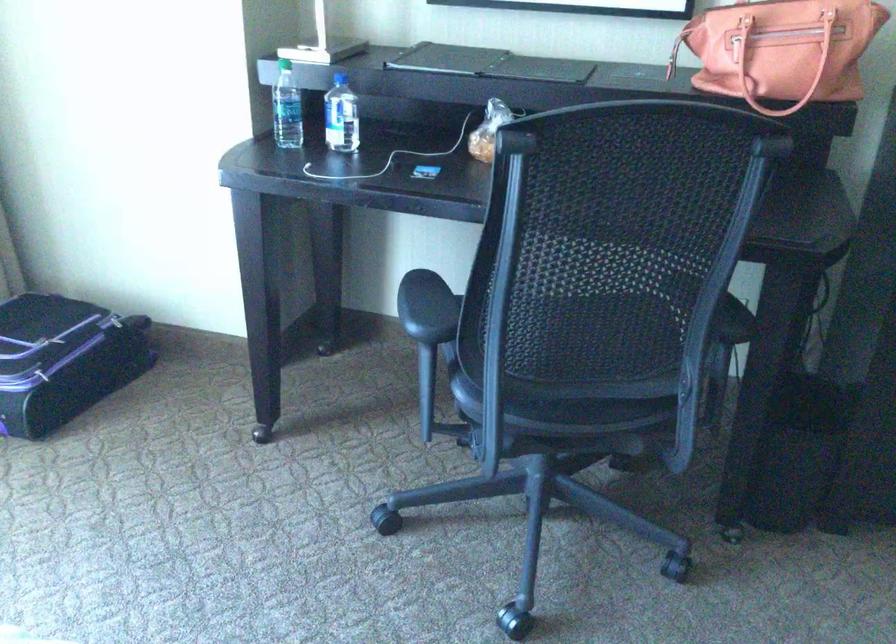
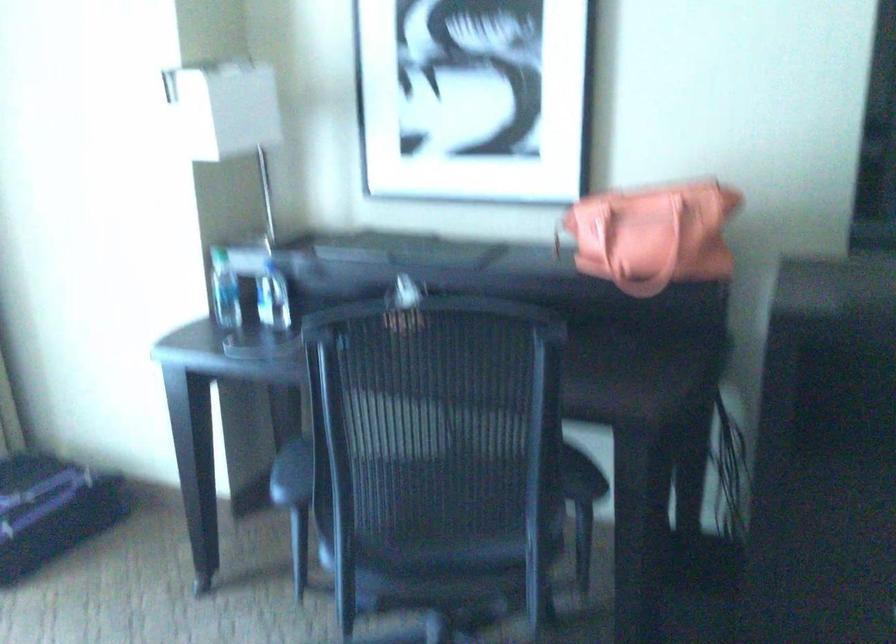
Find the pixel in the second image that matches (x=424, y=305) in the first image.

(291, 474)